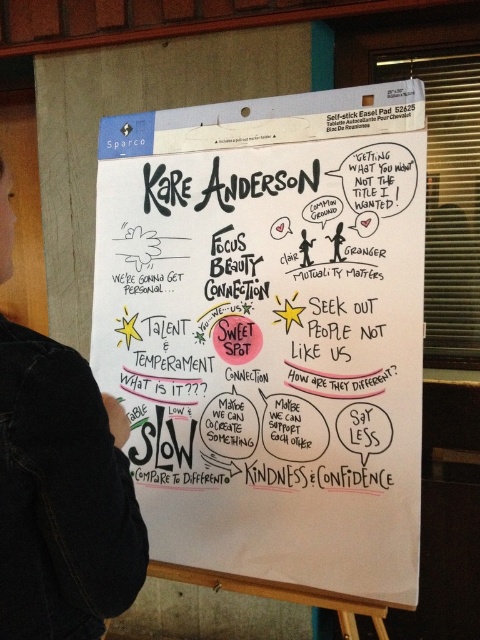
Question: Which point is closer to the camera?

Choices:
 (A) (109, 605)
 (B) (99, 243)

Answer: (A)

Question: Which of the following is the farthest from the observer?

Choices:
 (A) (263, 401)
 (B) (111, 532)

Answer: (A)

Question: Is white paper at center in front of black denim jacket at lower left?

Choices:
 (A) yes
 (B) no

Answer: (B)

Question: From the image, what is the correct spatial relationship of white paper at center in relation to black denim jacket at lower left?

Choices:
 (A) right
 (B) left

Answer: (A)

Question: Considering the relative positions of white paper at center and black denim jacket at lower left in the image provided, where is white paper at center located with respect to black denim jacket at lower left?

Choices:
 (A) below
 (B) above

Answer: (B)